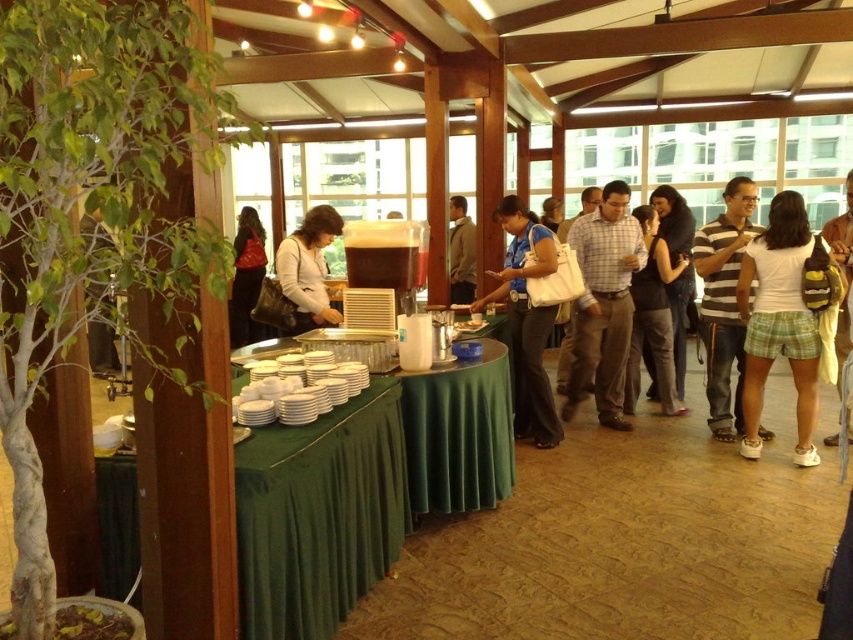
You are a guest at this event and want to sit down at the table with the blue fabric skirt at center and dark blue jeans at center. Which object should you move to make space?

The blue fabric skirt at center is wider than the dark blue jeans at center, so you should move the blue fabric skirt at center to create more space.

You are standing at the entrance of the event space and see two points marked in the image. Which point is closer to you, point (730,268) or point (235,337)?

Point (730,268) is in front of point (235,337), so it is closer to you.

You are organizing a photo shoot and need to ensure that all clothing items are visible in the frame. Given that the white cotton shirt at right and the dark blue jeans at center are both in the scene, which clothing item requires more space to be fully captured in the photo?

The dark blue jeans at center requires more space to be fully captured in the photo because it is larger than the white cotton shirt at right.